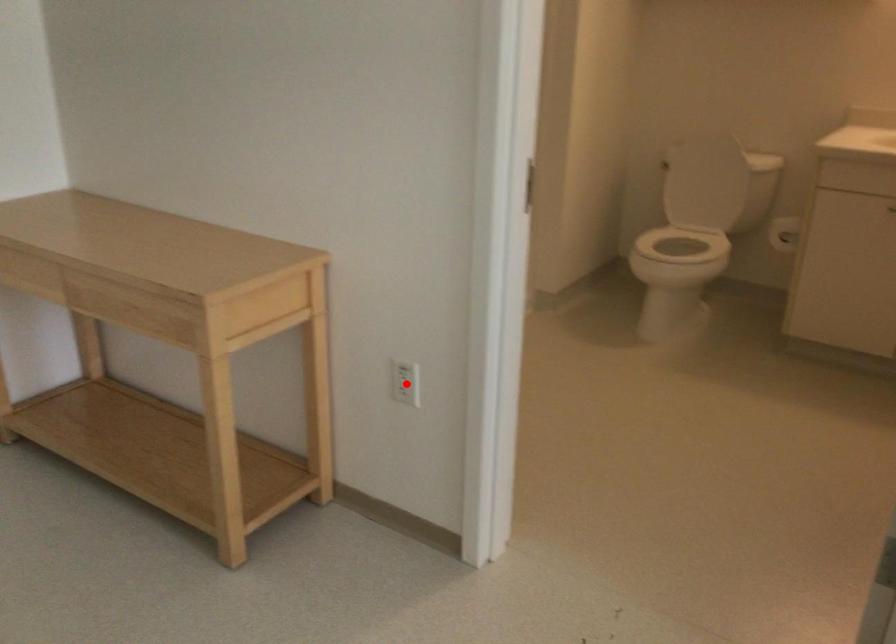
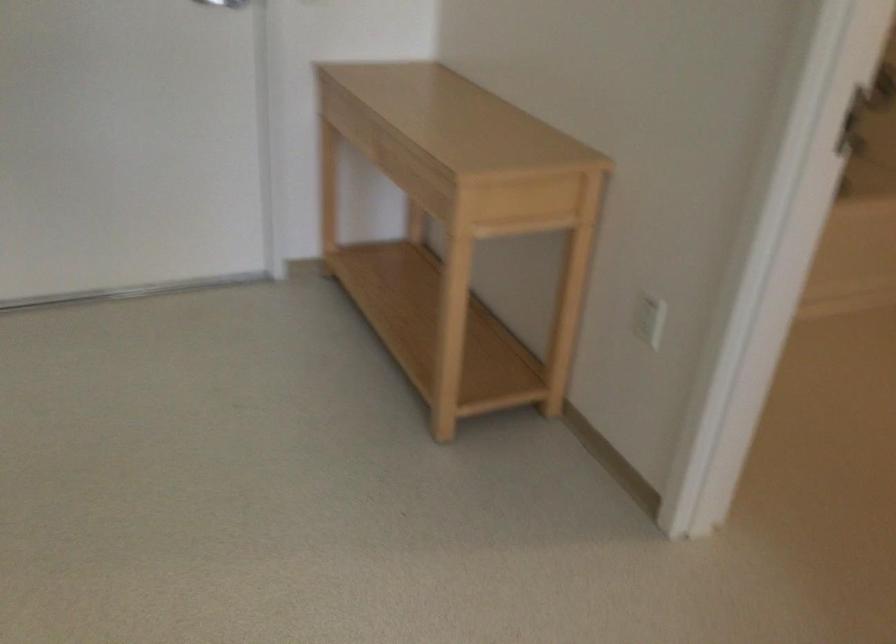
Locate, in the second image, the point that corresponds to the highlighted location in the first image.

(648, 317)